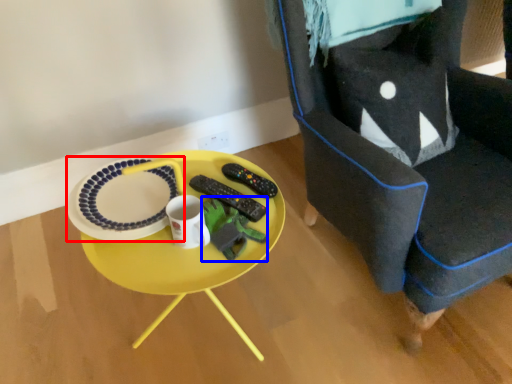
Question: Among these objects, which one is nearest to the camera, platter (highlighted by a red box) or toy (highlighted by a blue box)?

Choices:
 (A) platter
 (B) toy

Answer: (B)